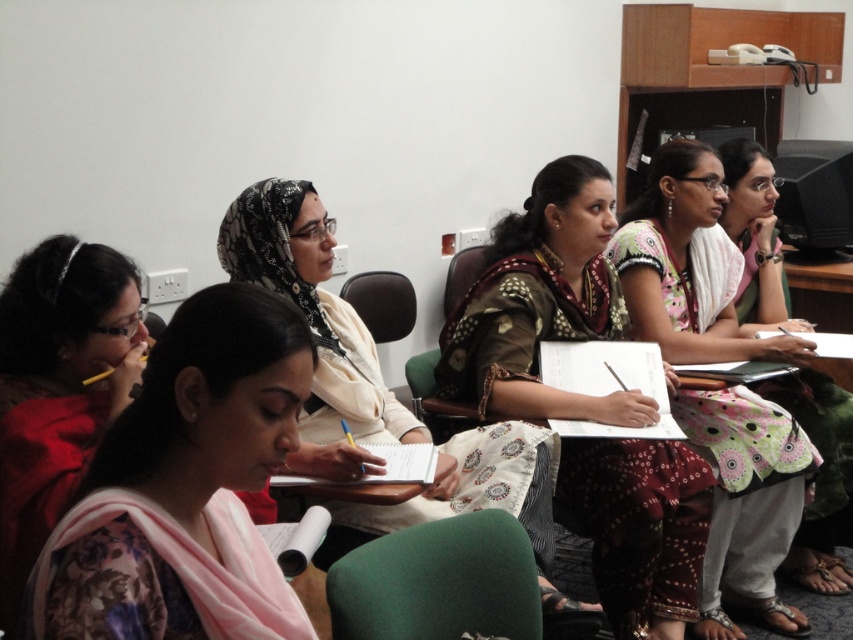
You are a photographer setting up for a group photo in the classroom. You want to ensure that the polka dot fabric dress at center and the matte black chair at center are both visible in the frame. Based on their positions, which object is closer to the camera?

The polka dot fabric dress at center is in front of the matte black chair at center, so the polka dot fabric dress at center is closer to the camera.

You are a photographer setting up a camera to take a group photo of the individuals in the classroom. You need to ensure that both the polka dot fabric dress at center and the matte black chair at center are in focus. Given that your camera has a depth of field that can cover objects within a 1.0 meter range, will both objects be in focus?

The polka dot fabric dress at center and matte black chair at center are 1.06 meters apart from each other. Since the distance between them exceeds the camera depth of field range of 1.0 meter, the camera may not be able to keep both objects in focus simultaneously.

You are organizing a cultural event and need to ensure there is enough space between the printed cotton saree at center and the matte black chair at center for attendees to move comfortably. What should you consider based on their sizes?

The printed cotton saree at center has a larger width than the matte black chair at center, so you should ensure there is sufficient space around the printed cotton saree at center to accommodate movement.